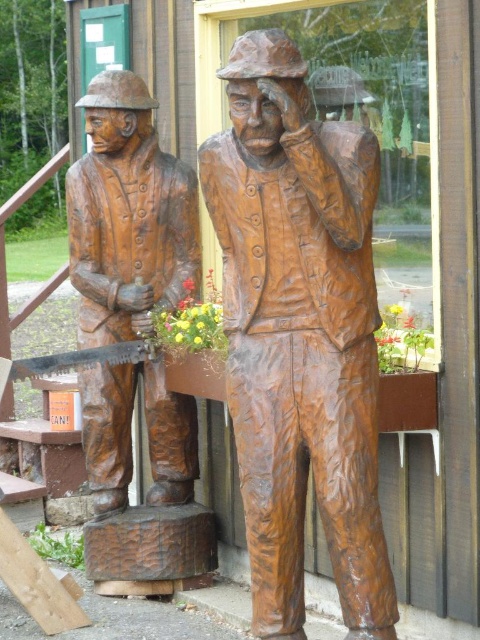
You are an art curator planning to move the bronze wood carving at center and the matte brown saw at left to a new exhibition space. The new space has a narrow corridor that only allows objects to pass if they are aligned in a straight line from left to right. Based on their current positions, can you arrange them in the required order without rotating them?

The bronze wood carving at center is to the right of the matte brown saw at left, so arranging them in the current left to right order would satisfy the corridor requirement. Therefore, they can be moved as is without rotation.

You are an art curator planning to move the bronze wood carving at center and the matte brown saw at left to a new exhibition space. The new space has a strict height restriction of 1.5 meters. Can both items be displayed without any modifications?

The bronze wood carving at center is located below matte brown saw at left. Since the height restriction is 1.5 meters, we need to know their individual heights. However, the description only provides their relative positions, not their actual dimensions. Therefore, it is uncertain if both items can be displayed without modifications.

You are standing in front of two wooden statues. You notice two points marked on them. One is at point (x=200, y=163) and the other is at point (x=194, y=260). Which point is nearer to you?

Point (x=200, y=163) is closer to the viewer than point (x=194, y=260).